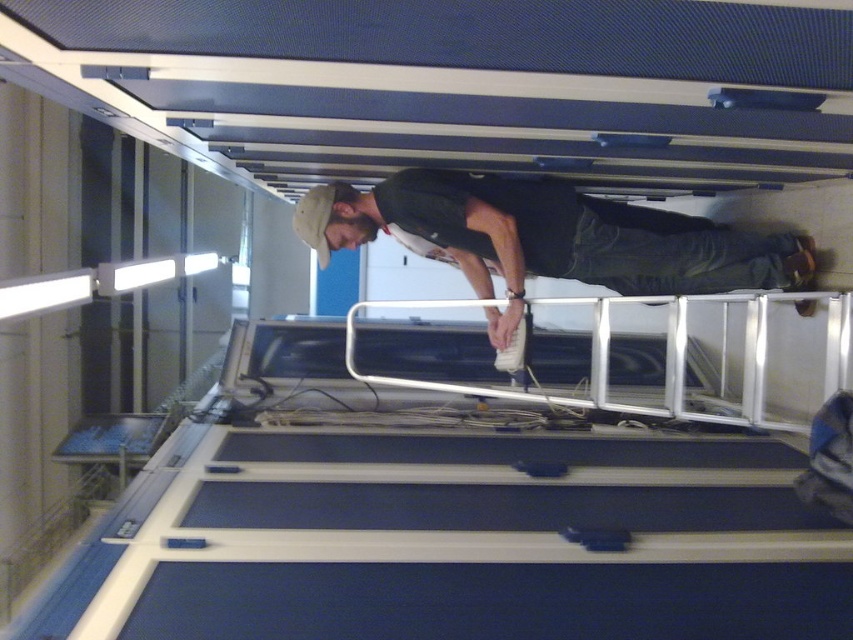
You are an engineer inspecting the equipment in the industrial setting. You need to determine if the dark green fabric shirt at center can be placed on the silver metallic rail at center without overlapping. Based on their widths, can it fit?

The dark green fabric shirt at center has a lesser width compared to the silver metallic rail at center, so it can fit without overlapping.

You are an engineer observing the scene. You need to determine if the dark green fabric shirt at center can be seen above the silver metallic rail at center. Based on the description, can you confirm this?

The dark green fabric shirt at center is much taller than the silver metallic rail at center, so yes, the dark green fabric shirt at center can be seen above the silver metallic rail at center.